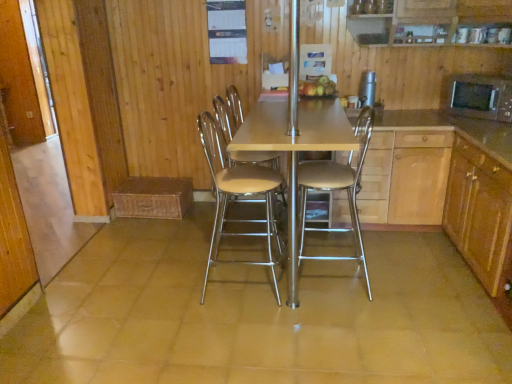
What is the approximate height of black matte microwave at right, the first appliance viewed from the right?

It is 11.42 inches.

The image size is (512, 384). What do you see at coordinates (311, 165) in the screenshot?
I see `matte wooden table at center` at bounding box center [311, 165].

Find the location of a particular element. The width and height of the screenshot is (512, 384). shiny golden apples at center is located at coordinates (318, 87).

The height and width of the screenshot is (384, 512). I want to click on metallic stainless steel water dispenser at upper center, which is the second appliance from right to left, so click(367, 89).

Is point (510, 96) positioned before point (324, 257)?

Yes, it is in front of point (324, 257).

Can you confirm if black matte microwave at right, the 2th appliance in the left-to-right sequence, is taller than metallic beige stool at center, arranged as the second chair when viewed from the left?

No.

Is there a large distance between black matte microwave at right, the first appliance viewed from the right, and metallic beige stool at center, arranged as the second chair when viewed from the left?

black matte microwave at right, the first appliance viewed from the right, is positioned a significant distance from metallic beige stool at center, arranged as the second chair when viewed from the left.

From a real-world perspective, is matte wooden table at center above or below beige leather chair at center, the 1th chair positioned from the left?

From a real-world perspective, matte wooden table at center is physically below beige leather chair at center, the 1th chair positioned from the left.

Is matte wooden table at center to the left of beige leather chair at center, the 2th chair in the right-to-left sequence, from the viewer's perspective?

In fact, matte wooden table at center is to the right of beige leather chair at center, the 2th chair in the right-to-left sequence.

The height and width of the screenshot is (384, 512). I want to click on the 1st chair behind the matte wooden table at center, starting your count from the anchor, so click(237, 194).

Which object is thinner, shiny golden apples at center or black matte microwave at right, the first appliance viewed from the right?

shiny golden apples at center.

Does point (331, 86) come closer to viewer compared to point (464, 105)?

No.

Consider the image. Is shiny golden apples at center not within black matte microwave at right, the first appliance viewed from the right?

That's correct, shiny golden apples at center is outside of black matte microwave at right, the first appliance viewed from the right.

Is shiny golden apples at center to the right of black matte microwave at right, the first appliance viewed from the right, from the viewer's perspective?

No, shiny golden apples at center is not to the right of black matte microwave at right, the first appliance viewed from the right.

Looking at the image, does shiny golden apples at center seem bigger or smaller compared to metallic beige stool at center, arranged as the second chair when viewed from the left?

shiny golden apples at center is smaller than metallic beige stool at center, arranged as the second chair when viewed from the left.

Is point (329, 92) less distant than point (354, 221)?

No, it is not.

Is shiny golden apples at center looking in the opposite direction of metallic beige stool at center, arranged as the second chair when viewed from the left?

No, metallic beige stool at center, arranged as the second chair when viewed from the left, is not at the back of shiny golden apples at center.

In the scene shown: From the image's perspective, is shiny golden apples at center located above or below metallic beige stool at center, the 1th chair in the right-to-left sequence?

Based on their image positions, shiny golden apples at center is located above metallic beige stool at center, the 1th chair in the right-to-left sequence.

From the image's perspective, does metallic beige stool at center, arranged as the second chair when viewed from the left, appear lower than metallic stainless steel water dispenser at upper center, which is the 1th appliance from left to right?

Yes, from the image's perspective, metallic beige stool at center, arranged as the second chair when viewed from the left, is below metallic stainless steel water dispenser at upper center, which is the 1th appliance from left to right.

Which object is closer to the camera taking this photo, metallic beige stool at center, arranged as the second chair when viewed from the left, or metallic stainless steel water dispenser at upper center, which is the 1th appliance from left to right?

metallic beige stool at center, arranged as the second chair when viewed from the left, is in front.

In the scene shown: From a real-world perspective, is metallic beige stool at center, the 1th chair in the right-to-left sequence, beneath metallic stainless steel water dispenser at upper center, which is the second appliance from right to left?

Correct, in the physical world, metallic beige stool at center, the 1th chair in the right-to-left sequence, is lower than metallic stainless steel water dispenser at upper center, which is the second appliance from right to left.

Is point (356, 241) closer or farther from the camera than point (361, 78)?

Point (356, 241) is closer to the camera than point (361, 78).

Is matte wooden table at center with metallic beige stool at center, arranged as the second chair when viewed from the left?

There is a gap between matte wooden table at center and metallic beige stool at center, arranged as the second chair when viewed from the left.

Is matte wooden table at center positioned behind metallic beige stool at center, arranged as the second chair when viewed from the left?

No, matte wooden table at center is in front of metallic beige stool at center, arranged as the second chair when viewed from the left.

Image resolution: width=512 pixels, height=384 pixels. Find the location of `kitchen & dining room table on the left side of metallic beige stool at center, the 1th chair in the right-to-left sequence`. kitchen & dining room table on the left side of metallic beige stool at center, the 1th chair in the right-to-left sequence is located at coordinates (311, 165).

I want to click on appliance lying above the black matte microwave at right, the 2th appliance in the left-to-right sequence (from the image's perspective), so click(367, 89).

From the picture: Is black matte microwave at right, the 2th appliance in the left-to-right sequence, inside the boundaries of metallic stainless steel water dispenser at upper center, which is the second appliance from right to left, or outside?

black matte microwave at right, the 2th appliance in the left-to-right sequence, exists outside the volume of metallic stainless steel water dispenser at upper center, which is the second appliance from right to left.

Considering the sizes of objects black matte microwave at right, the first appliance viewed from the right, and metallic stainless steel water dispenser at upper center, which is the second appliance from right to left, in the image provided, who is thinner, black matte microwave at right, the first appliance viewed from the right, or metallic stainless steel water dispenser at upper center, which is the second appliance from right to left,?

metallic stainless steel water dispenser at upper center, which is the second appliance from right to left.

Is black matte microwave at right, the 2th appliance in the left-to-right sequence, in front of or behind metallic stainless steel water dispenser at upper center, which is the 1th appliance from left to right, in the image?

Visually, black matte microwave at right, the 2th appliance in the left-to-right sequence, is located in front of metallic stainless steel water dispenser at upper center, which is the 1th appliance from left to right.

In order to click on the 1st chair positioned below the black matte microwave at right, the 2th appliance in the left-to-right sequence (from a real-world perspective) in this screenshot , I will do `click(338, 190)`.

This screenshot has width=512, height=384. There is a matte wooden table at center. Find the location of `the 2nd chair below it (from the image's perspective)`. the 2nd chair below it (from the image's perspective) is located at coordinates (237, 194).

When comparing their distances from shiny golden apples at center, does black matte microwave at right, the first appliance viewed from the right, or beige leather chair at center, the 1th chair positioned from the left, seem closer?

Based on the image, beige leather chair at center, the 1th chair positioned from the left, appears to be nearer to shiny golden apples at center.

Considering their positions, is shiny golden apples at center positioned closer to metallic beige stool at center, arranged as the second chair when viewed from the left, than metallic stainless steel water dispenser at upper center, which is the 1th appliance from left to right?

Based on the image, shiny golden apples at center appears to be nearer to metallic beige stool at center, arranged as the second chair when viewed from the left.

From the image, which object appears to be nearer to metallic beige stool at center, the 1th chair in the right-to-left sequence, beige leather chair at center, the 2th chair in the right-to-left sequence, or metallic stainless steel water dispenser at upper center, which is the 1th appliance from left to right?

beige leather chair at center, the 2th chair in the right-to-left sequence, lies closer to metallic beige stool at center, the 1th chair in the right-to-left sequence, than the other object.

Looking at the image, which one is located closer to black matte microwave at right, the first appliance viewed from the right, beige leather chair at center, the 2th chair in the right-to-left sequence, or metallic stainless steel water dispenser at upper center, which is the 1th appliance from left to right?

The object closer to black matte microwave at right, the first appliance viewed from the right, is metallic stainless steel water dispenser at upper center, which is the 1th appliance from left to right.

Which object lies further to the anchor point metallic stainless steel water dispenser at upper center, which is the second appliance from right to left, beige leather chair at center, the 1th chair positioned from the left, or shiny golden apples at center?

beige leather chair at center, the 1th chair positioned from the left, is further to metallic stainless steel water dispenser at upper center, which is the second appliance from right to left.

From the image, which object appears to be nearer to beige leather chair at center, the 2th chair in the right-to-left sequence, metallic stainless steel water dispenser at upper center, which is the 1th appliance from left to right, or matte wooden table at center?

The object closer to beige leather chair at center, the 2th chair in the right-to-left sequence, is matte wooden table at center.

Looking at the image, which one is located closer to metallic beige stool at center, the 1th chair in the right-to-left sequence, metallic stainless steel water dispenser at upper center, which is the 1th appliance from left to right, or matte wooden table at center?

matte wooden table at center is closer to metallic beige stool at center, the 1th chair in the right-to-left sequence.

Considering their positions, is beige leather chair at center, the 1th chair positioned from the left, positioned further to matte wooden table at center than metallic stainless steel water dispenser at upper center, which is the second appliance from right to left?

metallic stainless steel water dispenser at upper center, which is the second appliance from right to left, is positioned further to the anchor matte wooden table at center.

Image resolution: width=512 pixels, height=384 pixels. Find the location of `kitchen & dining room table between beige leather chair at center, the 2th chair in the right-to-left sequence, and black matte microwave at right, the 2th appliance in the left-to-right sequence, in the horizontal direction`. kitchen & dining room table between beige leather chair at center, the 2th chair in the right-to-left sequence, and black matte microwave at right, the 2th appliance in the left-to-right sequence, in the horizontal direction is located at coordinates (311, 165).

What are the coordinates of `chair located between matte wooden table at center and black matte microwave at right, the first appliance viewed from the right, in the left-right direction` in the screenshot? It's located at (338, 190).

The image size is (512, 384). I want to click on fruit between matte wooden table at center and black matte microwave at right, the first appliance viewed from the right, in the horizontal direction, so click(318, 87).

At what (x,y) coordinates should I click in order to perform the action: click on appliance between shiny golden apples at center and black matte microwave at right, the 2th appliance in the left-to-right sequence. Please return your answer as a coordinate pair (x, y). The image size is (512, 384). Looking at the image, I should click on (367, 89).